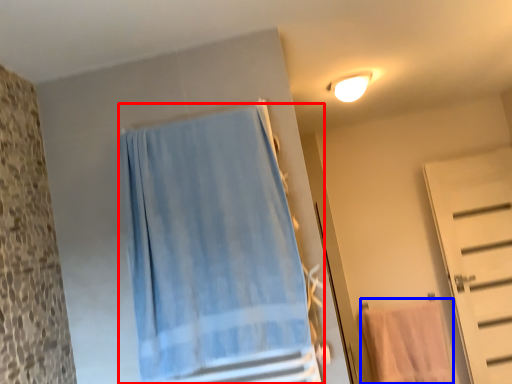
Question: Which object appears closest to the camera in this image, curtain (highlighted by a red box) or beach towel (highlighted by a blue box)?

Choices:
 (A) curtain
 (B) beach towel

Answer: (A)